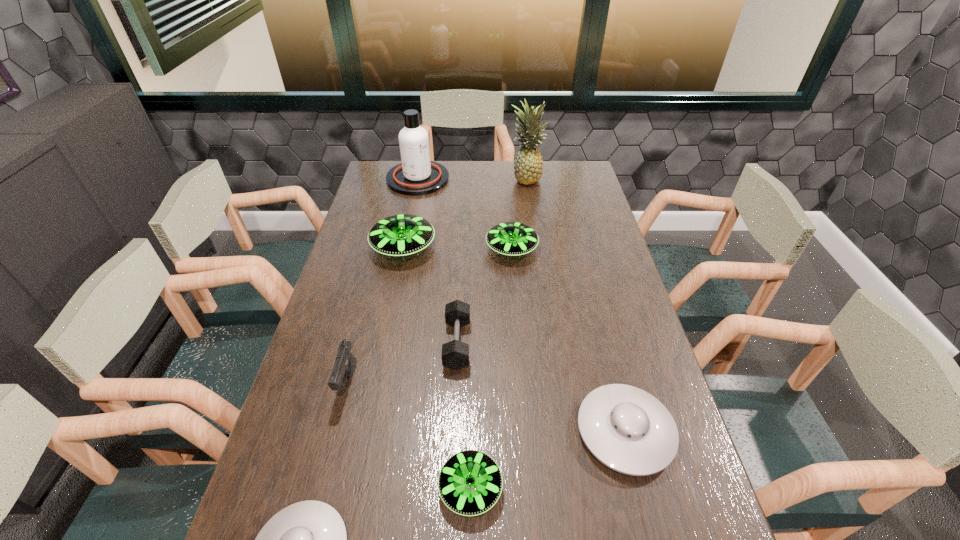
Locate an element on the screen. Image resolution: width=960 pixels, height=540 pixels. cleansing agent at the far edge is located at coordinates (416, 175).

You are a GUI agent. You are given a task and a screenshot of the screen. Output one action in this format:
    pyautogui.click(x=<x>, y=<y>)
    Task: Click on the cleansing agent positioned at the left edge
    This screenshot has height=540, width=960.
    Given the screenshot: What is the action you would take?
    pyautogui.click(x=416, y=175)

The image size is (960, 540). In order to click on saucer located at the left edge in this screenshot , I will do `click(400, 235)`.

The image size is (960, 540). I want to click on pistol that is at the left edge, so click(345, 364).

The width and height of the screenshot is (960, 540). I want to click on object positioned at the right edge, so click(627, 429).

Image resolution: width=960 pixels, height=540 pixels. I want to click on object at the far left corner, so click(416, 175).

The image size is (960, 540). In the image, there is a desktop. What are the coordinates of `vacant space at the far edge` in the screenshot? It's located at (480, 180).

The width and height of the screenshot is (960, 540). Find the location of `vacant space at the left edge of the desktop`. vacant space at the left edge of the desktop is located at coordinates 354,260.

The height and width of the screenshot is (540, 960). In the image, there is a desktop. Find the location of `vacant space at the right edge`. vacant space at the right edge is located at coordinates (571, 256).

At what (x,y) coordinates should I click in order to perform the action: click on free space that is in between the second biggest green saucer and the eighth shortest object. Please return your answer as a coordinate pair (x, y). This screenshot has width=960, height=540. Looking at the image, I should click on point(465,214).